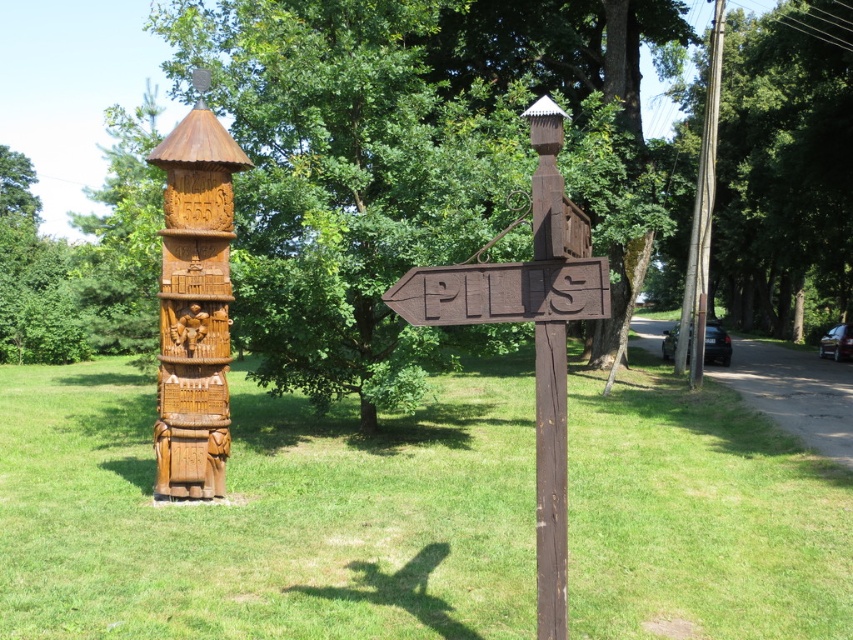
You are a gardener who needs to mow the lawn between the green grass at left and the brown wooden signpost at center. Your lawnmower has a maximum reach of 7 meters. Can you mow the entire area between them without moving the mower?

The distance between the green grass at left and the brown wooden signpost at center is 7.55 meters, which exceeds the lawnmower maximum reach of 7 meters. Therefore, you cannot mow the entire area without moving the mower.